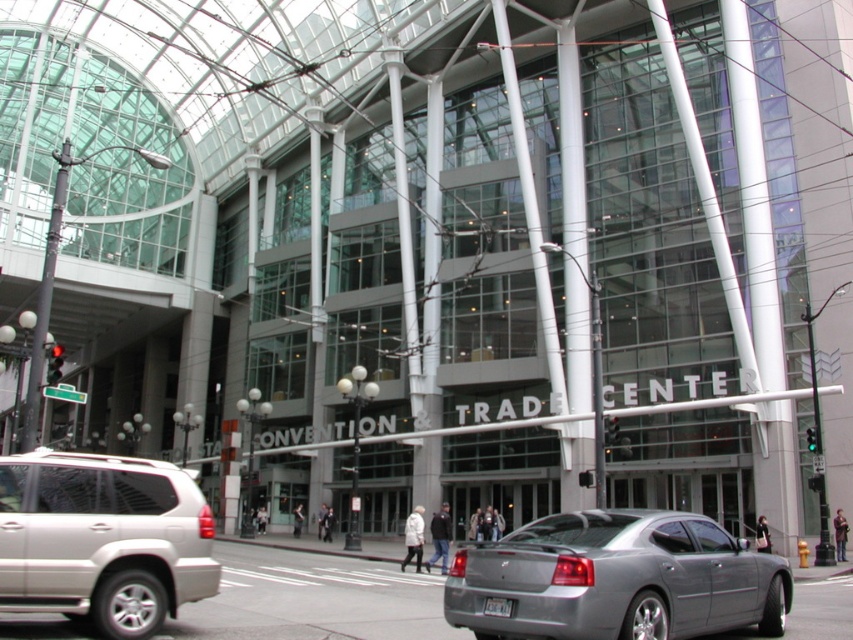
Question: Which of the following is the farthest from the observer?

Choices:
 (A) satin silver suv at lower left
 (B) silver metallic sedan at center

Answer: (A)

Question: Is silver metallic sedan at center further to camera compared to satin silver suv at lower left?

Choices:
 (A) yes
 (B) no

Answer: (B)

Question: Can you confirm if silver metallic sedan at center is positioned to the right of satin silver suv at lower left?

Choices:
 (A) no
 (B) yes

Answer: (B)

Question: Is silver metallic sedan at center wider than satin silver suv at lower left?

Choices:
 (A) no
 (B) yes

Answer: (A)